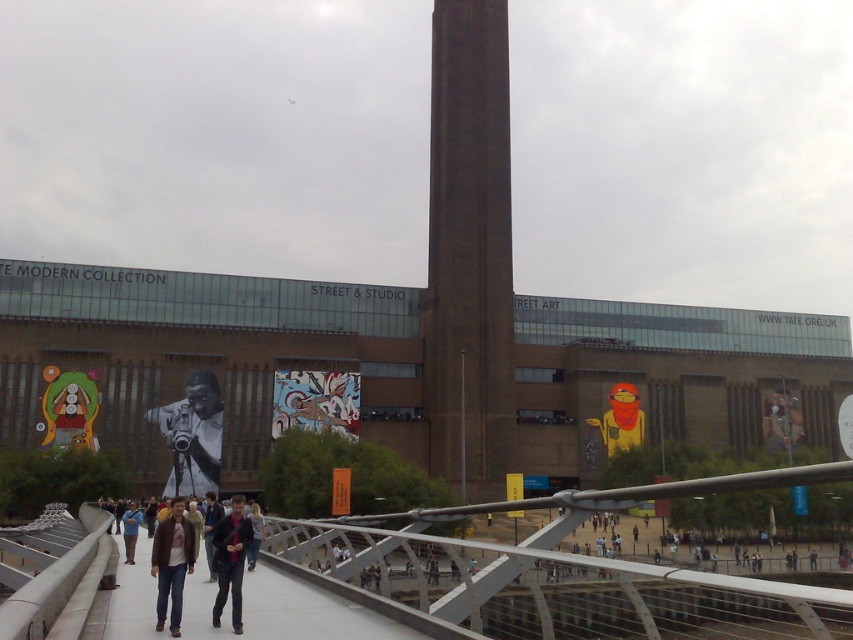
You are a tourist standing on the pedestrian bridge and want to take a photo of the brown brick tower at center and the dark brown leather jacket at center. Which object should you zoom in more on to capture both in the frame?

The brown brick tower at center has a lesser width compared to dark brown leather jacket at center, so you should zoom in more on the dark brown leather jacket at center to ensure both fit in the frame.

You are a photographer standing on the pedestrian bridge and want to capture both the brown brick tower at center and the brown leather jacket at center in the same frame. Which object should you adjust your camera angle to include first if one is wider than the other?

The brown brick tower at center might be wider than the brown leather jacket at center, so you should adjust your camera angle to include the brown brick tower at center first to ensure it fits in the frame.